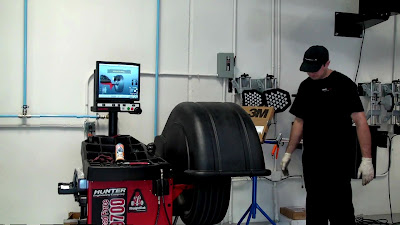
At what (x,y) coordinates should I click in order to perform the action: click on blue stand leg. Please return your answer as a coordinate pair (x, y). This screenshot has width=400, height=225. Looking at the image, I should click on (254, 192).